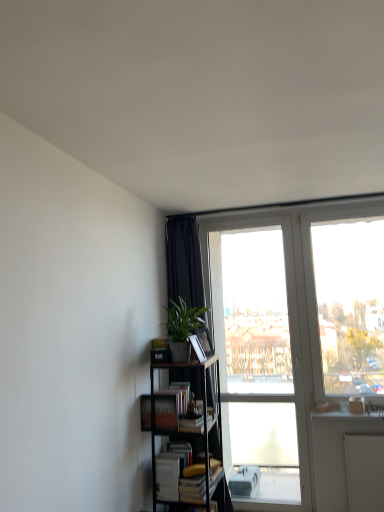
Question: Should I look upward or downward to see black metal bookcase at lower left?

Choices:
 (A) down
 (B) up

Answer: (A)

Question: Is black fabric curtain at upper left beside green matte plant at center-left?

Choices:
 (A) no
 (B) yes

Answer: (A)

Question: Would you say green matte plant at center-left is part of black fabric curtain at upper left's contents?

Choices:
 (A) no
 (B) yes

Answer: (A)

Question: From the image's perspective, does black fabric curtain at upper left appear lower than green matte plant at center-left?

Choices:
 (A) yes
 (B) no

Answer: (A)

Question: Is the position of black fabric curtain at upper left less distant than that of green matte plant at center-left?

Choices:
 (A) no
 (B) yes

Answer: (A)

Question: Does black fabric curtain at upper left have a greater width compared to green matte plant at center-left?

Choices:
 (A) no
 (B) yes

Answer: (B)

Question: Can you confirm if black fabric curtain at upper left is positioned to the right of green matte plant at center-left?

Choices:
 (A) yes
 (B) no

Answer: (A)

Question: Is the position of black metal bookcase at lower left less distant than that of hardcover book at center, placed as the 1th paperback book when sorted from bottom to top?

Choices:
 (A) no
 (B) yes

Answer: (B)

Question: Are black metal bookcase at lower left and hardcover book at center, placed as the 1th paperback book when sorted from bottom to top, located far from each other?

Choices:
 (A) yes
 (B) no

Answer: (B)

Question: Does black metal bookcase at lower left turn towards hardcover book at center, the 2th paperback book from the top?

Choices:
 (A) no
 (B) yes

Answer: (B)

Question: Is black metal bookcase at lower left located outside hardcover book at center, placed as the 1th paperback book when sorted from bottom to top?

Choices:
 (A) yes
 (B) no

Answer: (A)

Question: Considering the relative sizes of black metal bookcase at lower left and hardcover book at center, placed as the 1th paperback book when sorted from bottom to top, in the image provided, is black metal bookcase at lower left thinner than hardcover book at center, placed as the 1th paperback book when sorted from bottom to top,?

Choices:
 (A) no
 (B) yes

Answer: (A)

Question: Does black metal bookcase at lower left come behind hardcover book at center, placed as the 1th paperback book when sorted from bottom to top?

Choices:
 (A) yes
 (B) no

Answer: (B)

Question: Is hardcover book at center, placed as the 1th paperback book when sorted from bottom to top, aimed at white matte book at lower center, marked as the 2th book in a top-to-bottom arrangement?

Choices:
 (A) no
 (B) yes

Answer: (A)